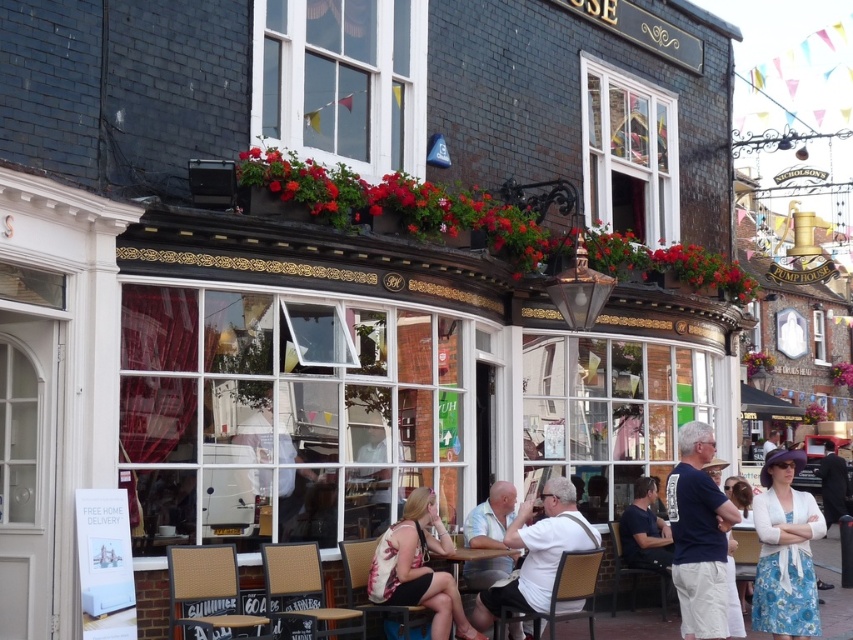
Is point (461, 608) farther from viewer compared to point (547, 541)?

No.

Does floral fabric dress at center lie in front of white fabric shirt at center?

Yes, it is.

What do you see at coordinates (418, 566) in the screenshot?
I see `floral fabric dress at center` at bounding box center [418, 566].

Where is `floral fabric dress at center`? This screenshot has width=853, height=640. floral fabric dress at center is located at coordinates (418, 566).

Describe the element at coordinates (785, 552) in the screenshot. This screenshot has width=853, height=640. I see `floral fabric dress at lower right` at that location.

This screenshot has height=640, width=853. In order to click on floral fabric dress at lower right in this screenshot , I will do `click(785, 552)`.

Is white fabric shirt at center positioned in front of wooden table at center?

Yes.

Which is behind, point (532, 586) or point (482, 547)?

The point (482, 547) is more distant.

What do you see at coordinates (537, 552) in the screenshot? I see `white fabric shirt at center` at bounding box center [537, 552].

The height and width of the screenshot is (640, 853). Find the location of `white fabric shirt at center`. white fabric shirt at center is located at coordinates (537, 552).